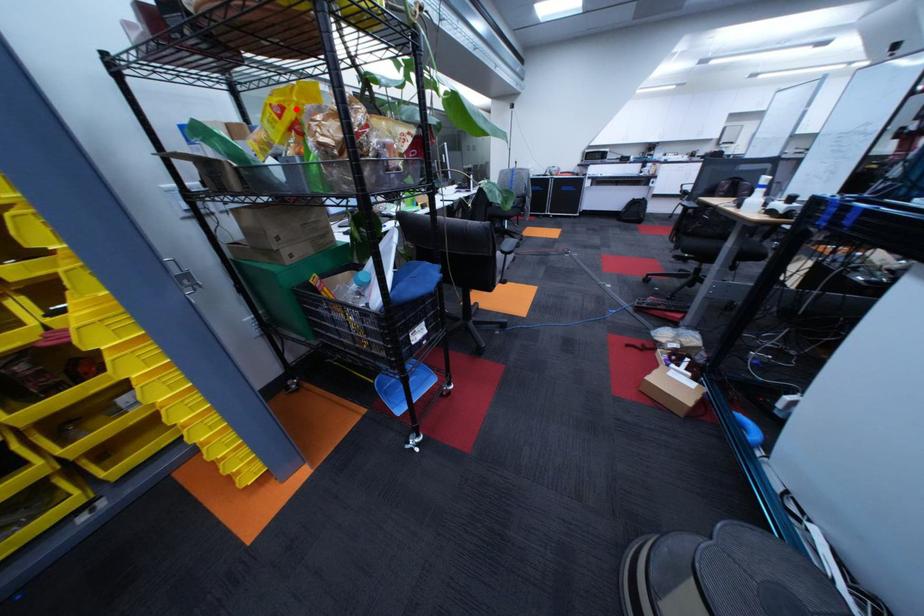
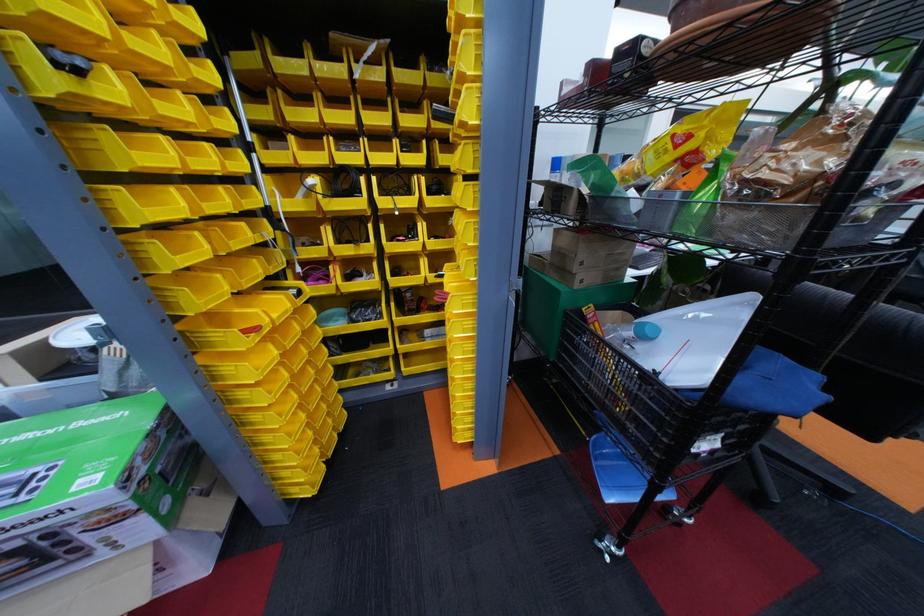
In the second image, find the point that corresponds to the highlighted location in the first image.

(702, 138)